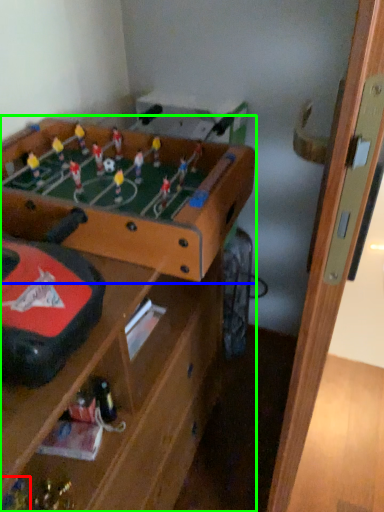
Question: Which object is the closest to the toy (highlighted by a red box)? Choose among these: table (highlighted by a blue box) or table (highlighted by a green box).

Choices:
 (A) table
 (B) table

Answer: (B)